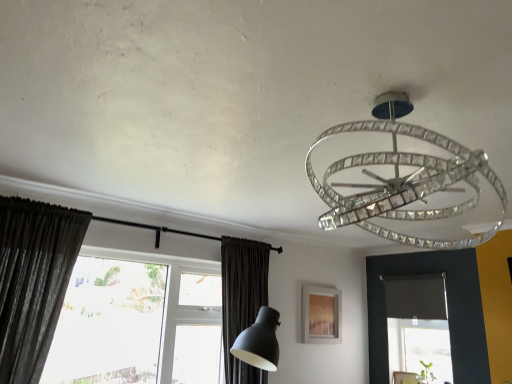
Question: Based on their sizes in the image, would you say dark matte fabric curtain at lower center, arranged as the 1th curtain when viewed from the back, is bigger or smaller than clear crystal chandelier at upper center?

Choices:
 (A) big
 (B) small

Answer: (A)

Question: From their relative heights in the image, would you say dark matte fabric curtain at lower center, which is counted as the second curtain, starting from the left, is taller or shorter than clear crystal chandelier at upper center?

Choices:
 (A) tall
 (B) short

Answer: (A)

Question: Based on their relative distances, which object is farther from the clear crystal chandelier at upper center?

Choices:
 (A) transparent glass window at lower left
 (B) dark gray textured curtain at left, the 1th curtain positioned from the left
 (C) dark matte fabric curtain at lower center, which is counted as the second curtain, starting from the left
 (D) wooden frame at center

Answer: (A)

Question: Which object is positioned closest to the transparent glass window at lower left?

Choices:
 (A) dark gray textured curtain at left, the 1th curtain from the front
 (B) dark matte fabric curtain at lower center, arranged as the 1th curtain when viewed from the right
 (C) wooden frame at center
 (D) clear crystal chandelier at upper center

Answer: (B)